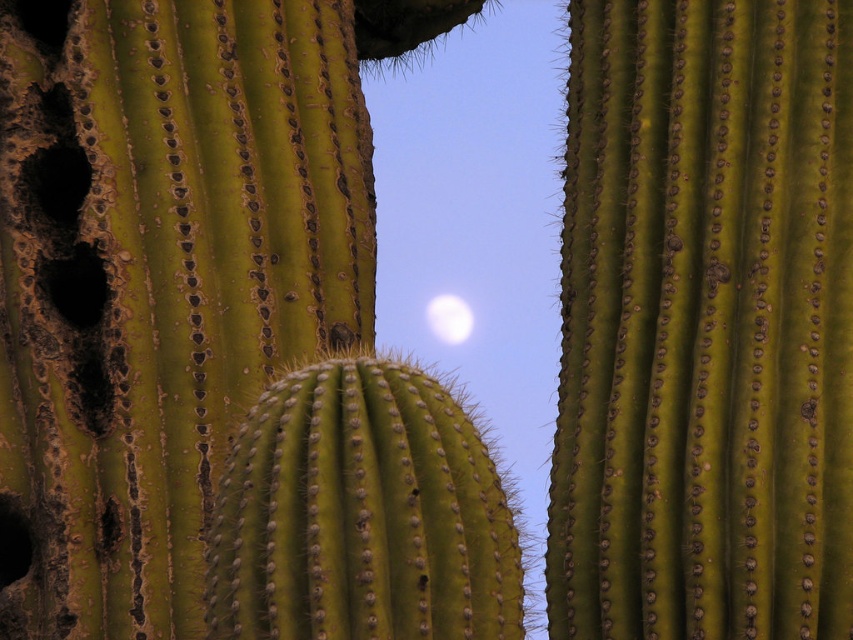
You are an astronomer observing the night sky and notice the green spiny cactus at center and the white translucent moon at upper center. Which object is bigger in your field of view?

The green spiny cactus at center is larger in size than the white translucent moon at upper center, so the cactus appears bigger in your field of view.

You are stargazing and notice the green spiny cactus at center and the white translucent moon at upper center. Which object is positioned higher in the sky?

The white translucent moon at upper center is positioned higher in the sky than the green spiny cactus at center.

You are standing in front of the cactus garden and want to touch the green spiny cactus at center and the white translucent moon at upper center. Which object can you reach first without moving your position?

The green spiny cactus at center is closer to the viewer than the white translucent moon at upper center, so you can reach the green spiny cactus at center first without moving your position.